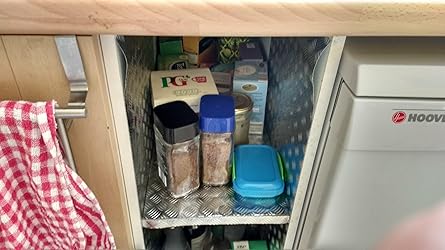
Identify the location of shelf edges. The height and width of the screenshot is (250, 445). (338, 52), (222, 220), (121, 123), (135, 233), (289, 239).